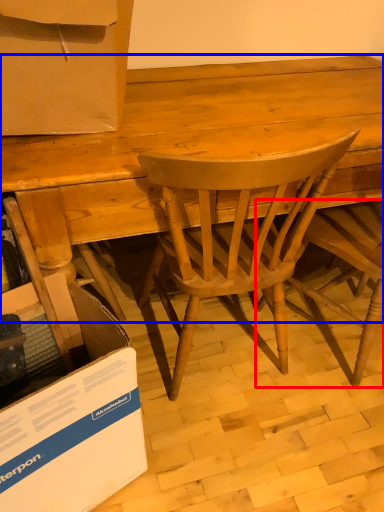
Question: Which of the following is the farthest to the observer, chair (highlighted by a red box) or desk (highlighted by a blue box)?

Choices:
 (A) chair
 (B) desk

Answer: (B)